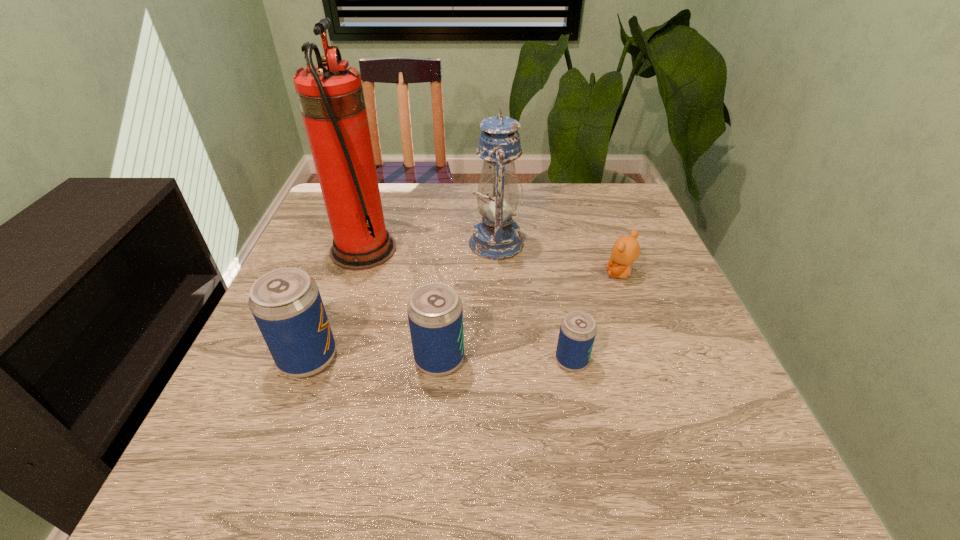
Find the location of a particular element. vacant place for an extra beer can on the right is located at coordinates (705, 362).